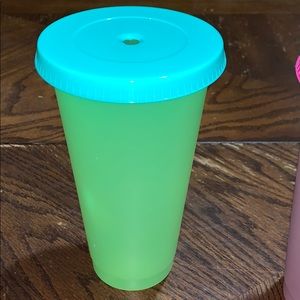
Image resolution: width=300 pixels, height=300 pixels. Identify the location of cup. (155, 168).